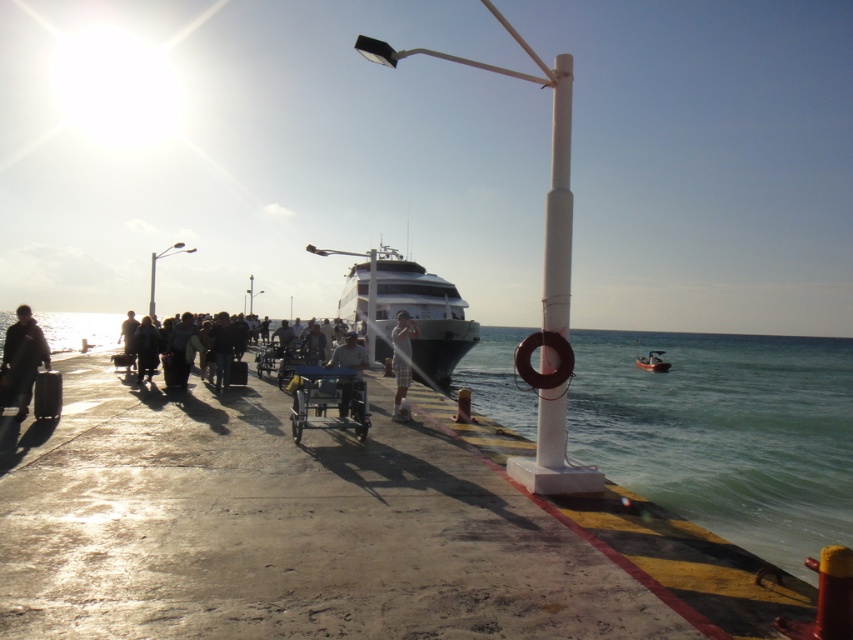
Question: Which is nearer to the green water at lower right?

Choices:
 (A) light brown shorts at center
 (B) shiny white yacht at center
 (C) white matte pole at center

Answer: (B)

Question: Considering the real-world distances, which object is closest to the metallic silver boat at lower right?

Choices:
 (A) white plastic pole at center
 (B) white matte lamp post at center
 (C) dark clothing at center
 (D) concrete dock at center

Answer: (D)

Question: Is white matte lamp post at center thinner than white plastic pole at center?

Choices:
 (A) no
 (B) yes

Answer: (A)

Question: Can you confirm if light brown shorts at center is positioned to the left of white plastic lamp post at center?

Choices:
 (A) no
 (B) yes

Answer: (A)

Question: Where is light blue fabric shirt at center located in relation to metallic silver boat at lower right in the image?

Choices:
 (A) below
 (B) above

Answer: (B)

Question: Which object is positioned closest to the white matte pole at center?

Choices:
 (A) white plastic pole at center
 (B) matte black suitcase at left
 (C) shiny white yacht at center
 (D) white plastic lamp post at upper center

Answer: (B)